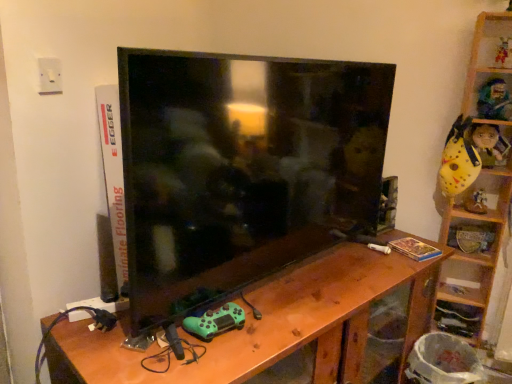
Question: Is point (228, 321) positioned closer to the camera than point (156, 226)?

Choices:
 (A) closer
 (B) farther

Answer: (B)

Question: Relative to matte black tv at center, is green matte controller at lower center, which ranks as the 1th toy in front-to-back order, in front or behind?

Choices:
 (A) front
 (B) behind

Answer: (B)

Question: Estimate the real-world distances between objects in this image. Which object is closer to the wooden at right, positioned as the first shelf in top-to-bottom order?

Choices:
 (A) white plastic electric outlet at upper left
 (B) wooden carved mask at upper right, acting as the 4th toy starting from the back
 (C) wooden at right, the 2th shelf positioned from the top
 (D) wooden table at center
 (E) yellow matte plush toy at upper right, the 5th toy in the front-to-back sequence

Answer: (C)

Question: Which object is the farthest from the yellow matte plush toy at upper right, which is counted as the 4th toy, starting from the right?

Choices:
 (A) white plastic electric outlet at upper left
 (B) wooden carved mask at upper right, acting as the 4th toy starting from the back
 (C) green matte controller at lower center, which is counted as the first toy, starting from the bottom
 (D) matte yellow plush toy at upper right, marked as the third toy in a top-to-bottom arrangement
 (E) matte black tv at center

Answer: (A)